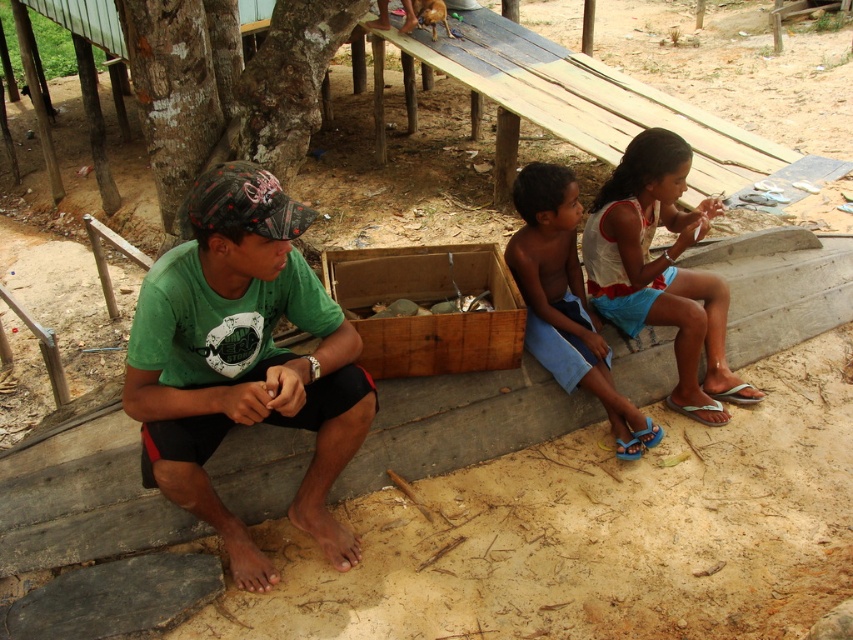
Question: Which point is farther to the camera?

Choices:
 (A) blue fabric shorts at center
 (B) green fabric shirt at center

Answer: (A)

Question: Where is white cotton shirt at center located in relation to blue fabric shorts at center in the image?

Choices:
 (A) above
 (B) below

Answer: (A)

Question: Is green fabric shirt at center thinner than white cotton shirt at center?

Choices:
 (A) yes
 (B) no

Answer: (A)

Question: Which of the following is the farthest from the observer?

Choices:
 (A) blue fabric shorts at center
 (B) green fabric shirt at center
 (C) white cotton shirt at center

Answer: (C)

Question: Can you confirm if green fabric shirt at center is positioned to the left of blue fabric shorts at center?

Choices:
 (A) yes
 (B) no

Answer: (A)

Question: Which object appears closest to the camera in this image?

Choices:
 (A) white cotton shirt at center
 (B) blue fabric shorts at center
 (C) green fabric shirt at center

Answer: (C)